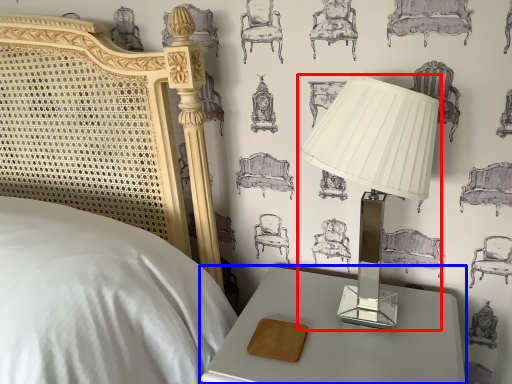
Question: Which of the following is the closest to the observer, lamp (highlighted by a red box) or nightstand (highlighted by a blue box)?

Choices:
 (A) lamp
 (B) nightstand

Answer: (A)